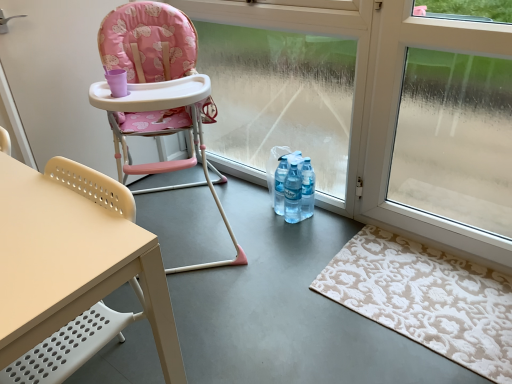
Describe the element at coordinates (455, 139) in the screenshot. I see `transparent glass window at lower right` at that location.

Measure the distance between point (312, 112) and camera.

7.21 feet.

Where is `translucent plastic bottles at center`? The width and height of the screenshot is (512, 384). translucent plastic bottles at center is located at coordinates (294, 188).

The image size is (512, 384). I want to click on pink fabric highchair at left, the 1th chair when ordered from back to front, so click(158, 93).

Is transparent glass window at center to the left of beige plastic chair at left, which is the second chair in back-to-front order, from the viewer's perspective?

In fact, transparent glass window at center is to the right of beige plastic chair at left, which is the second chair in back-to-front order.

Which of these two, transparent glass window at center or beige plastic chair at left, which is the second chair in back-to-front order, stands taller?

With more height is transparent glass window at center.

Is transparent glass window at center located outside beige plastic chair at left, marked as the 1th chair in a front-to-back arrangement?

Indeed, transparent glass window at center is completely outside beige plastic chair at left, marked as the 1th chair in a front-to-back arrangement.

Is point (210, 51) farther from viewer compared to point (5, 225)?

Yes, it is.

Is pink fabric highchair at left, the 1th chair when ordered from back to front, situated inside beige textured rug at lower right or outside?

pink fabric highchair at left, the 1th chair when ordered from back to front, cannot be found inside beige textured rug at lower right.

From the image's perspective, is pink fabric highchair at left, marked as the 2th chair in a front-to-back arrangement, above beige textured rug at lower right?

Indeed, from the image's perspective, pink fabric highchair at left, marked as the 2th chair in a front-to-back arrangement, is shown above beige textured rug at lower right.

Is pink fabric highchair at left, marked as the 2th chair in a front-to-back arrangement, turned away from beige textured rug at lower right?

pink fabric highchair at left, marked as the 2th chair in a front-to-back arrangement, does not have its back to beige textured rug at lower right.

Considering the sizes of objects translucent plastic bottles at center and transparent glass window at center in the image provided, who is bigger, translucent plastic bottles at center or transparent glass window at center?

transparent glass window at center.

Is translucent plastic bottles at center directly adjacent to transparent glass window at center?

They are not placed beside each other.

Considering the points (298, 181) and (287, 42), which point is in front, point (298, 181) or point (287, 42)?

Positioned in front is point (287, 42).

From the image's perspective, between transparent glass window at lower right and beige plastic chair at left, marked as the 1th chair in a front-to-back arrangement, which one is located above?

transparent glass window at lower right, from the image's perspective.

Between transparent glass window at lower right and beige plastic chair at left, which is the second chair in back-to-front order, which one has larger size?

Bigger between the two is beige plastic chair at left, which is the second chair in back-to-front order.

Is transparent glass window at lower right oriented away from beige plastic chair at left, which is the second chair in back-to-front order?

No, transparent glass window at lower right's orientation is not away from beige plastic chair at left, which is the second chair in back-to-front order.

Is transparent glass window at lower right surrounding beige plastic chair at left, which is the second chair in back-to-front order?

Actually, beige plastic chair at left, which is the second chair in back-to-front order, is outside transparent glass window at lower right.

Is beige textured rug at lower right turned away from transparent glass window at lower right?

No, beige textured rug at lower right is not facing away from transparent glass window at lower right.

Which object is wider, beige textured rug at lower right or transparent glass window at lower right?

beige textured rug at lower right is wider.

You are a GUI agent. You are given a task and a screenshot of the screen. Output one action in this format:
    pyautogui.click(x=<x>, y=<y>)
    Task: Click on the mat that is on the left side of transparent glass window at lower right
    This screenshot has height=384, width=512.
    Given the screenshot: What is the action you would take?
    pyautogui.click(x=426, y=298)

From a real-world perspective, does transparent glass window at lower right stand above beige textured rug at lower right?

Correct, in the physical world, transparent glass window at lower right is higher than beige textured rug at lower right.

This screenshot has height=384, width=512. Identify the location of mat below the transparent glass window at lower right (from the image's perspective). (426, 298).

In terms of width, does transparent glass window at lower right look wider or thinner when compared to beige textured rug at lower right?

Considering their sizes, transparent glass window at lower right looks slimmer than beige textured rug at lower right.

Is point (440, 200) positioned behind point (495, 299)?

Yes, it is.

What are the coordinates of `chair above the transparent glass window at lower right (from the image's perspective)` in the screenshot? It's located at (158, 93).

From a real-world perspective, who is located higher, transparent glass window at lower right or pink fabric highchair at left, the 1th chair when ordered from back to front?

transparent glass window at lower right.

Considering the relative positions of transparent glass window at lower right and pink fabric highchair at left, marked as the 2th chair in a front-to-back arrangement, in the image provided, is transparent glass window at lower right to the left of pink fabric highchair at left, marked as the 2th chair in a front-to-back arrangement, from the viewer's perspective?

No.

From the image's perspective, who appears lower, transparent glass window at lower right or pink fabric highchair at left, the 1th chair when ordered from back to front?

transparent glass window at lower right is shown below in the image.

Locate an element on the screen. This screenshot has width=512, height=384. window frame on the right of beige plastic chair at left, marked as the 1th chair in a front-to-back arrangement is located at coordinates (287, 86).

Where is `mat located below the pink fabric highchair at left, marked as the 2th chair in a front-to-back arrangement (from the image's perspective)`? The image size is (512, 384). mat located below the pink fabric highchair at left, marked as the 2th chair in a front-to-back arrangement (from the image's perspective) is located at coordinates (426, 298).

Which object lies further to the anchor point transparent glass window at lower right, beige textured rug at lower right or beige plastic chair at left, marked as the 1th chair in a front-to-back arrangement?

Among the two, beige plastic chair at left, marked as the 1th chair in a front-to-back arrangement, is located further to transparent glass window at lower right.

Estimate the real-world distances between objects in this image. Which object is closer to beige plastic chair at left, marked as the 1th chair in a front-to-back arrangement, transparent glass window at lower right or translucent plastic bottles at center?

Answer: translucent plastic bottles at center.

Looking at the image, which one is located closer to beige textured rug at lower right, translucent plastic bottles at center or transparent glass window at lower right?

Among the two, transparent glass window at lower right is located nearer to beige textured rug at lower right.

Which object lies nearer to the anchor point transparent glass window at lower right, translucent plastic bottles at center or beige textured rug at lower right?

beige textured rug at lower right is positioned closer to the anchor transparent glass window at lower right.

Looking at the image, which one is located further to translucent plastic bottles at center, transparent glass window at lower right or pink fabric highchair at left, the 1th chair when ordered from back to front?

transparent glass window at lower right.

Which object lies further to the anchor point beige plastic chair at left, which is the second chair in back-to-front order, transparent glass window at center or translucent plastic bottles at center?

Among the two, transparent glass window at center is located further to beige plastic chair at left, which is the second chair in back-to-front order.

From the image, which object appears to be nearer to transparent glass window at lower right, translucent plastic bottles at center or pink fabric highchair at left, marked as the 2th chair in a front-to-back arrangement?

translucent plastic bottles at center is closer to transparent glass window at lower right.

Considering their positions, is beige textured rug at lower right positioned closer to translucent plastic bottles at center than beige plastic chair at left, marked as the 1th chair in a front-to-back arrangement?

beige textured rug at lower right is closer to translucent plastic bottles at center.

Locate an element on the screen. The image size is (512, 384). window frame between pink fabric highchair at left, marked as the 2th chair in a front-to-back arrangement, and translucent plastic bottles at center from front to back is located at coordinates (287, 86).

This screenshot has height=384, width=512. I want to click on window frame between beige plastic chair at left, which is the second chair in back-to-front order, and translucent plastic bottles at center from front to back, so click(x=287, y=86).

Where is `window frame between pink fabric highchair at left, the 1th chair when ordered from back to front, and beige textured rug at lower right`? Image resolution: width=512 pixels, height=384 pixels. window frame between pink fabric highchair at left, the 1th chair when ordered from back to front, and beige textured rug at lower right is located at coordinates (287, 86).

Locate an element on the screen. window frame between pink fabric highchair at left, the 1th chair when ordered from back to front, and transparent glass window at lower right, in the horizontal direction is located at coordinates (287, 86).